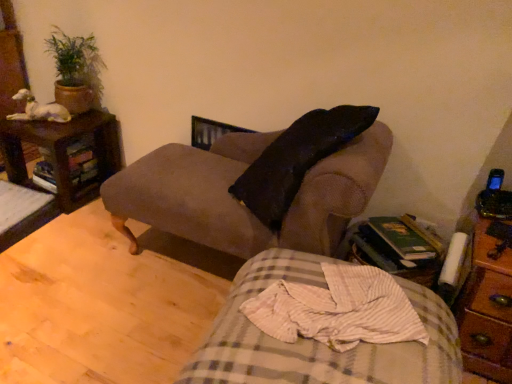
Identify the location of unoccupied area in front of white matte statue at upper left. This screenshot has height=384, width=512. (39, 124).